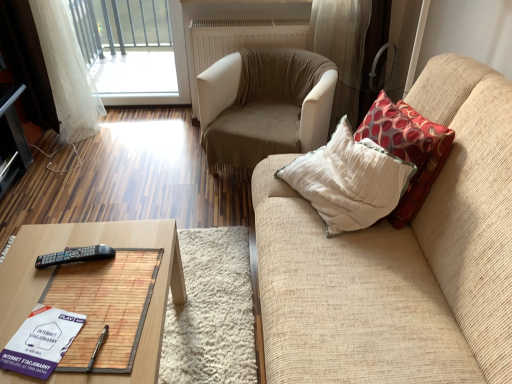
The width and height of the screenshot is (512, 384). Identify the location of free location to the right of purple paper book at lower left. (106, 339).